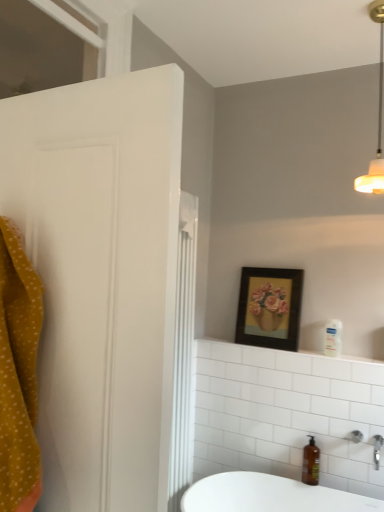
This screenshot has height=512, width=384. Identify the location of free spot above wooden framed picture at upper center (from a real-world perspective). (278, 257).